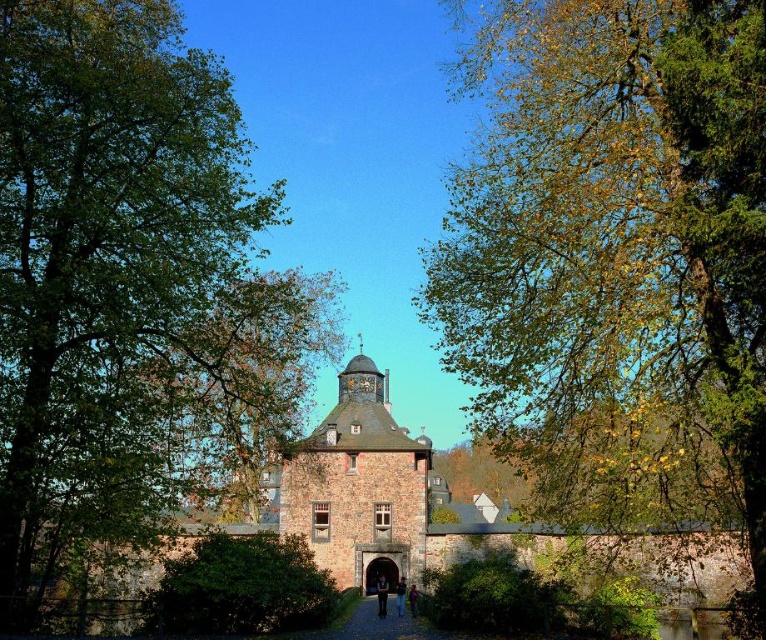
Can you confirm if yellow-green leaves at upper right is smaller than brown stone path at center?

Actually, yellow-green leaves at upper right might be larger than brown stone path at center.

Between point (490, 304) and point (329, 627), which one is positioned behind?

Positioned behind is point (329, 627).

Between point (745, 88) and point (395, 627), which one is positioned behind?

The point (395, 627) is behind.

Find the location of a particular element. The image size is (766, 640). yellow-green leaves at upper right is located at coordinates (614, 259).

Does green leafy tree at center have a larger size compared to green leafy bush at center?

Yes.

Which is in front, point (182, 488) or point (286, 620)?

Point (286, 620) is in front.

Where is `green leafy tree at center`? The image size is (766, 640). green leafy tree at center is located at coordinates (237, 381).

Between green leafy tree at upper left and green leafy tree at center, which one is positioned lower?

green leafy tree at center is below.

Is green leafy tree at upper left smaller than green leafy tree at center?

No.

Is point (15, 225) positioned behind point (262, 285)?

No.

Locate an element on the screen. green leafy tree at upper left is located at coordinates (129, 289).